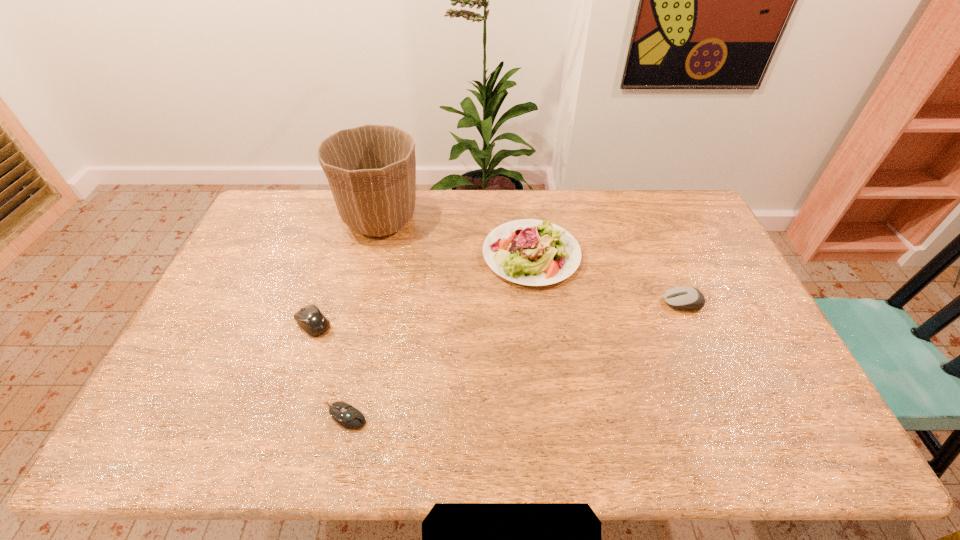
Find the location of a particular element. The image size is (960, 540). flowerpot is located at coordinates (371, 169).

Find the location of a particular element. the second object from right to left is located at coordinates (531, 252).

At what (x,y) coordinates should I click in order to perform the action: click on salad plate. Please return your answer as a coordinate pair (x, y). The width and height of the screenshot is (960, 540). Looking at the image, I should click on (531, 252).

Where is `the leftmost computer mouse`? This screenshot has height=540, width=960. the leftmost computer mouse is located at coordinates (310, 318).

This screenshot has height=540, width=960. What are the coordinates of `the rightmost computer mouse` in the screenshot? It's located at (685, 297).

This screenshot has width=960, height=540. Find the location of `the nearest computer mouse`. the nearest computer mouse is located at coordinates click(x=346, y=415).

This screenshot has height=540, width=960. Identify the location of the nearest object. (346, 415).

Where is `vacant point located 0.220m on the front of the tallest object`? The image size is (960, 540). vacant point located 0.220m on the front of the tallest object is located at coordinates (362, 295).

The image size is (960, 540). I want to click on free space located 0.240m on the right of the salad plate, so click(652, 254).

Locate an element on the screen. This screenshot has height=540, width=960. free space located on the back of the leftmost computer mouse is located at coordinates (327, 280).